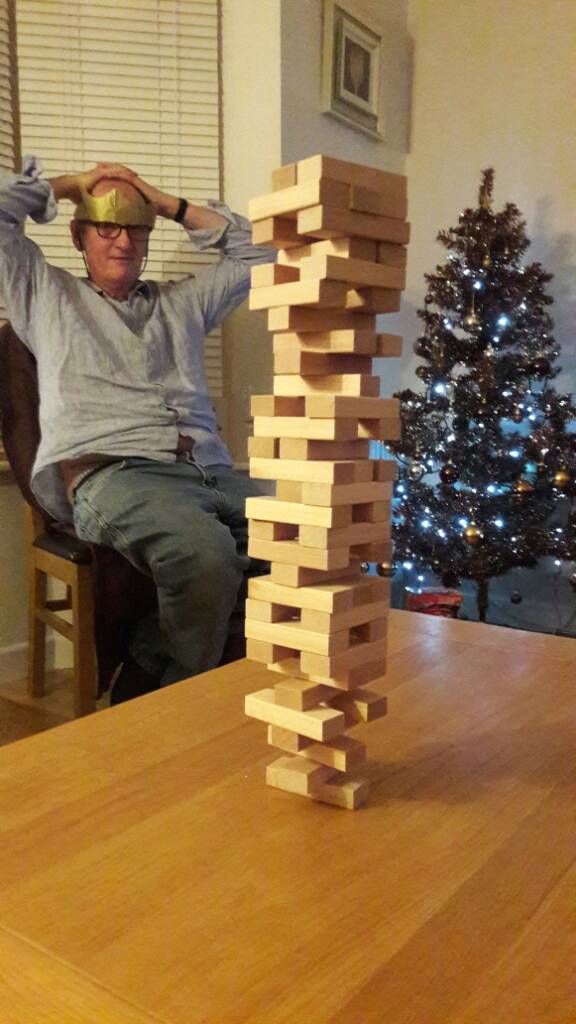
The width and height of the screenshot is (576, 1024). Identify the location of holiday decor. (480, 376).